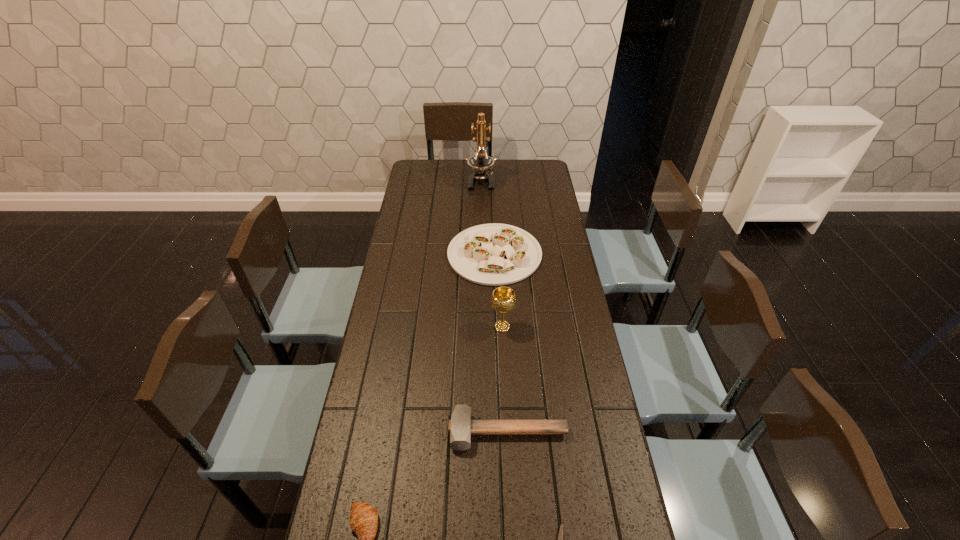
Where is `free area in between the third nearest object and the platter`? free area in between the third nearest object and the platter is located at coordinates (501, 343).

Find the location of `object that is the third nearest to the chalice`. object that is the third nearest to the chalice is located at coordinates (560, 537).

The image size is (960, 540). Find the location of `object identified as the fourth closest to the fifth tallest object`. object identified as the fourth closest to the fifth tallest object is located at coordinates (494, 254).